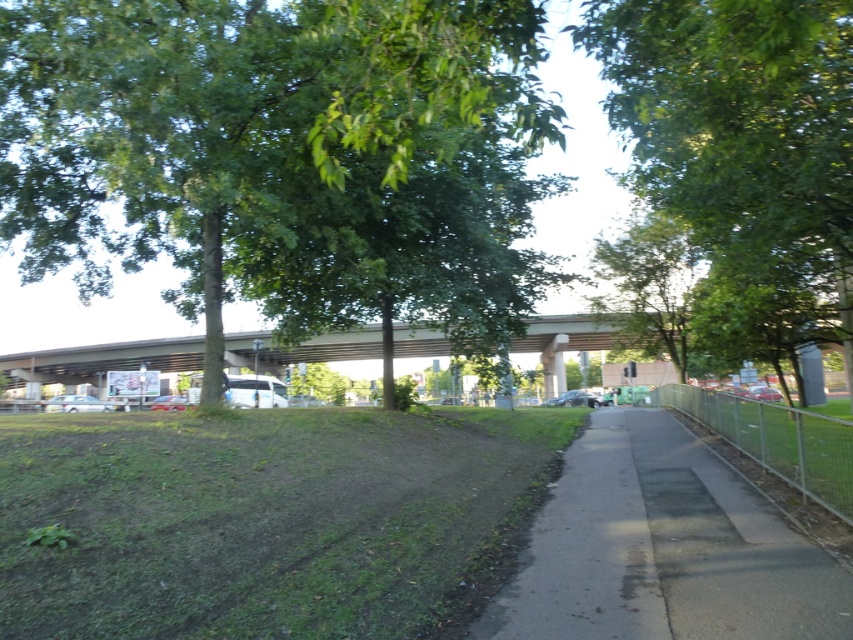
Question: Is the position of smooth asphalt path at center less distant than that of concrete bridge at center?

Choices:
 (A) no
 (B) yes

Answer: (B)

Question: Which of the following is the farthest from the observer?

Choices:
 (A) (350, 77)
 (B) (126, 428)
 (C) (703, 609)

Answer: (B)

Question: Which point is closer to the camera taking this photo?

Choices:
 (A) (647, 340)
 (B) (579, 394)
 (C) (526, 52)
 (D) (160, 403)

Answer: (C)

Question: Is smooth asphalt path at center smaller than white matte car at lower left?

Choices:
 (A) yes
 (B) no

Answer: (A)

Question: In this image, where is green leafy tree at center located relative to satin silver sedan at center?

Choices:
 (A) above
 (B) below

Answer: (A)

Question: Among these objects, which one is nearest to the camera?

Choices:
 (A) green leafy tree at center
 (B) green leafy tree at upper center
 (C) satin silver sedan at center

Answer: (A)